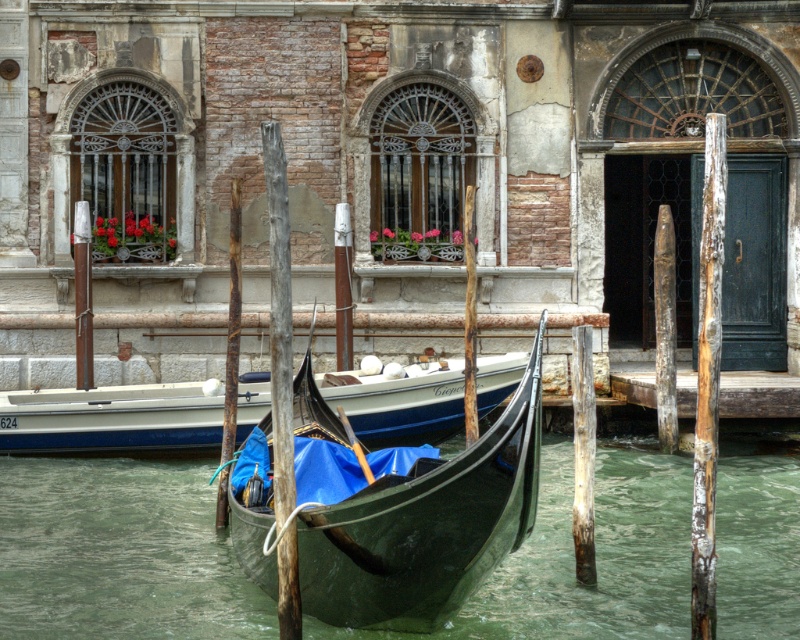
Does green water at gondola center appear on the left side of shiny dark green gondola at center?

Incorrect, green water at gondola center is not on the left side of shiny dark green gondola at center.

Can you confirm if green water at gondola center is wider than shiny dark green gondola at center?

Correct, the width of green water at gondola center exceeds that of shiny dark green gondola at center.

Measure the distance between point (541, 552) and camera.

Point (541, 552) is 60.29 feet from camera.

At what (x,y) coordinates should I click in order to perform the action: click on green water at gondola center. Please return your answer as a coordinate pair (x, y). Looking at the image, I should click on (118, 554).

Which is more to the left, green water at gondola center or blue fabric gondola at center?

blue fabric gondola at center

Can you confirm if green water at gondola center is positioned below blue fabric gondola at center?

Yes, green water at gondola center is below blue fabric gondola at center.

Which is behind, point (640, 573) or point (413, 433)?

Point (413, 433)

Locate an element on the screen. green water at gondola center is located at coordinates (118, 554).

Is shiny dark green gondola at center bigger than blue fabric gondola at center?

Incorrect, shiny dark green gondola at center is not larger than blue fabric gondola at center.

Does point (382, 536) lie behind point (196, 412)?

No, (382, 536) is closer to viewer.

Locate an element on the screen. shiny dark green gondola at center is located at coordinates (408, 512).